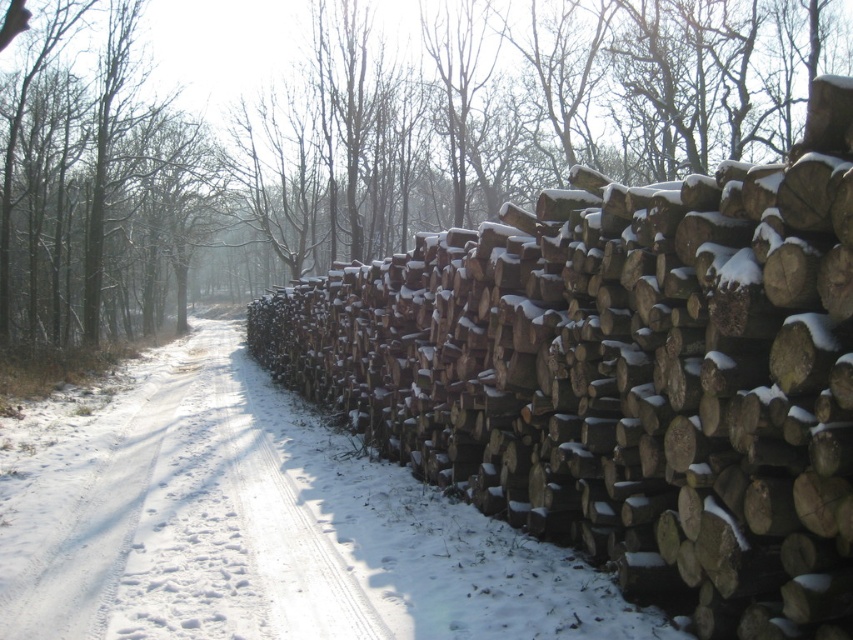
Consider the image. You are standing at the center of the snow path and want to reach the white powdery snow at right. Which direction should you move towards?

You should move towards the right direction to reach the white powdery snow at right.